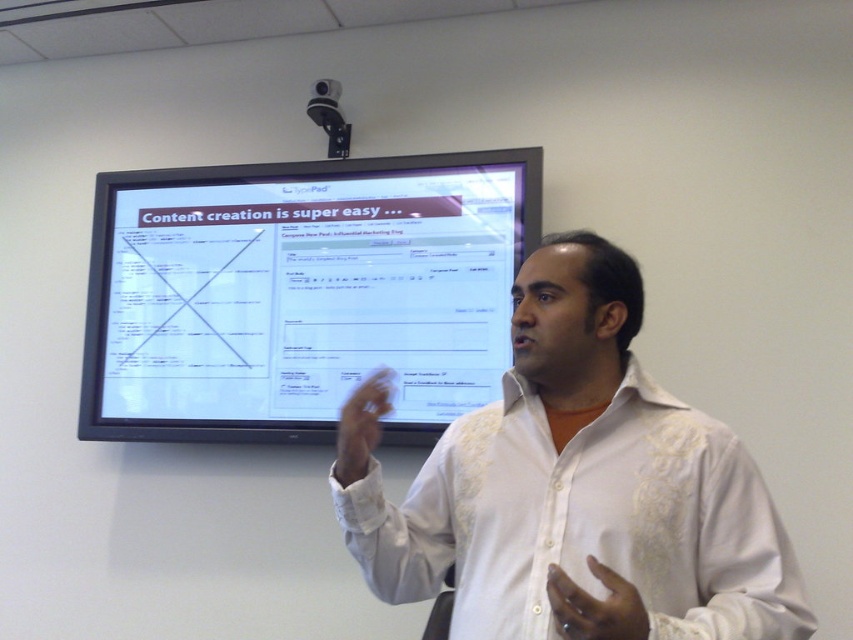
Question: From the image, what is the correct spatial relationship of white embroidered shirt at center in relation to white matte hand at center?

Choices:
 (A) above
 (B) below

Answer: (B)

Question: Among these objects, which one is nearest to the camera?

Choices:
 (A) white matte hand at center
 (B) white embroidered shirt at center

Answer: (B)

Question: Which point appears closest to the camera in this image?

Choices:
 (A) (351, 410)
 (B) (585, 616)

Answer: (B)

Question: From the image, what is the correct spatial relationship of white embroidered shirt at center in relation to dark skin/hair at center?

Choices:
 (A) right
 (B) left

Answer: (A)

Question: Does matte black screen at upper center appear on the right side of white matte hand at center?

Choices:
 (A) no
 (B) yes

Answer: (A)

Question: Estimate the real-world distances between objects in this image. Which object is closer to the dark skin/hair at center?

Choices:
 (A) matte black screen at upper center
 (B) white matte hand at center
 (C) white embroidered shirt at center

Answer: (C)